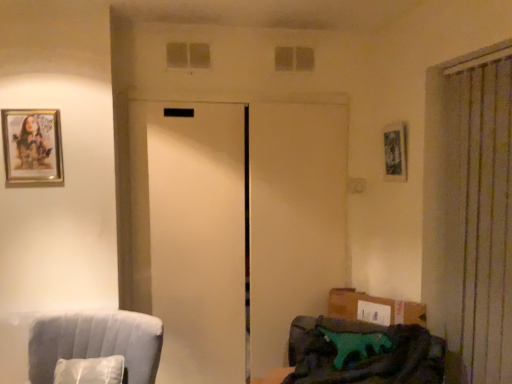
Question: Is clear glass window at upper center, which is the 2th window in back-to-front order, completely or partially outside of gold-framed picture at upper left, acting as the 1th picture frame starting from the front?

Choices:
 (A) yes
 (B) no

Answer: (A)

Question: Is there a large distance between clear glass window at upper center, which is the 2th window in back-to-front order, and gold-framed picture at upper left, acting as the 1th picture frame starting from the front?

Choices:
 (A) yes
 (B) no

Answer: (B)

Question: Is clear glass window at upper center, which appears as the 2th window when viewed from the right, further to camera compared to gold-framed picture at upper left, which is the 2th picture frame in back-to-front order?

Choices:
 (A) yes
 (B) no

Answer: (A)

Question: From the image's perspective, is clear glass window at upper center, which is the 2th window in back-to-front order, on top of gold-framed picture at upper left, which is the 1th picture frame in left-to-right order?

Choices:
 (A) yes
 (B) no

Answer: (A)

Question: Is clear glass window at upper center, which appears as the 2th window when viewed from the right, smaller than gold-framed picture at upper left, which is the 2th picture frame in back-to-front order?

Choices:
 (A) no
 (B) yes

Answer: (B)

Question: Can you confirm if clear glass window at upper center, which is the 2th window in back-to-front order, is shorter than gold-framed picture at upper left, which is the 2th picture frame in back-to-front order?

Choices:
 (A) no
 (B) yes

Answer: (B)

Question: Is teal fabric couch at lower right, which ranks as the first furniture in right-to-left order, bigger than velvet blue armchair at lower left, the second furniture from the right?

Choices:
 (A) no
 (B) yes

Answer: (B)

Question: Is teal fabric couch at lower right, arranged as the second furniture when viewed from the left, thinner than velvet blue armchair at lower left, arranged as the first furniture when viewed from the left?

Choices:
 (A) no
 (B) yes

Answer: (A)

Question: Does teal fabric couch at lower right, which ranks as the first furniture in right-to-left order, come behind velvet blue armchair at lower left, arranged as the first furniture when viewed from the left?

Choices:
 (A) no
 (B) yes

Answer: (A)

Question: From the image's perspective, is teal fabric couch at lower right, arranged as the second furniture when viewed from the left, located above velvet blue armchair at lower left, the second furniture from the right?

Choices:
 (A) no
 (B) yes

Answer: (A)

Question: Does teal fabric couch at lower right, which ranks as the first furniture in right-to-left order, come in front of velvet blue armchair at lower left, arranged as the first furniture when viewed from the left?

Choices:
 (A) no
 (B) yes

Answer: (B)

Question: Is teal fabric couch at lower right, which ranks as the first furniture in right-to-left order, beside velvet blue armchair at lower left, arranged as the first furniture when viewed from the left?

Choices:
 (A) no
 (B) yes

Answer: (A)

Question: Is metallic silver picture frame at upper right, the 1th picture frame in the back-to-front sequence, surrounded by green fabric pillow at lower right?

Choices:
 (A) yes
 (B) no

Answer: (B)